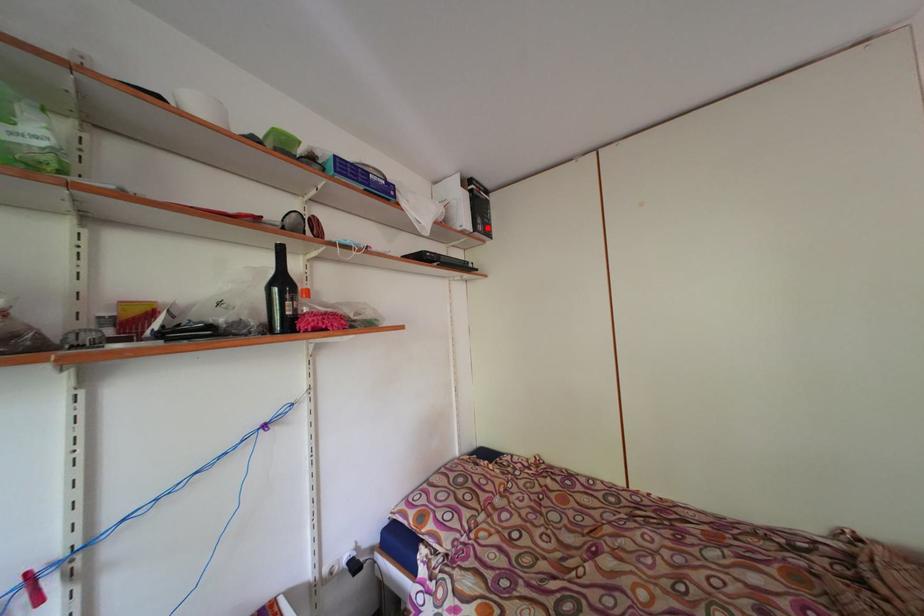
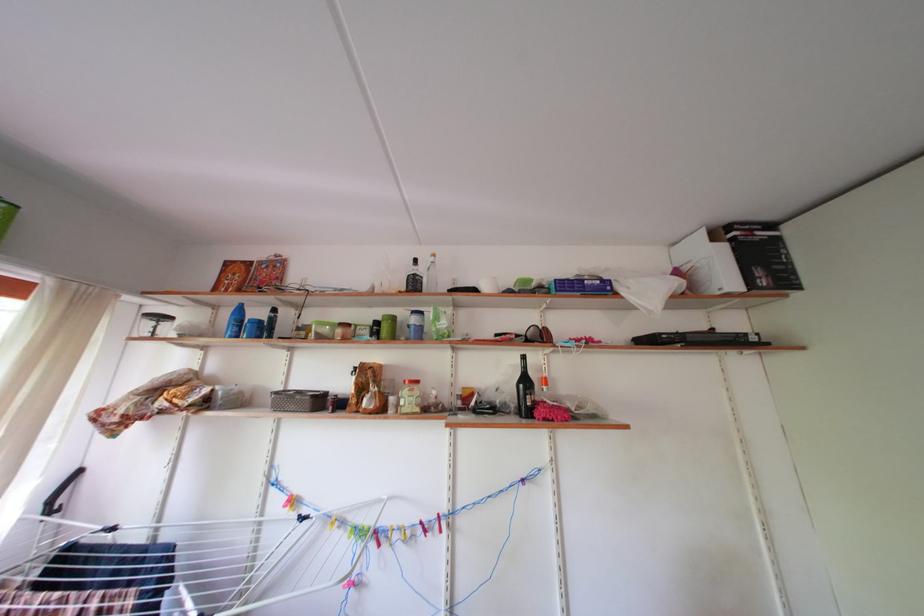
Locate, in the second image, the point that corresponds to the highlighted location in the first image.

(768, 278)